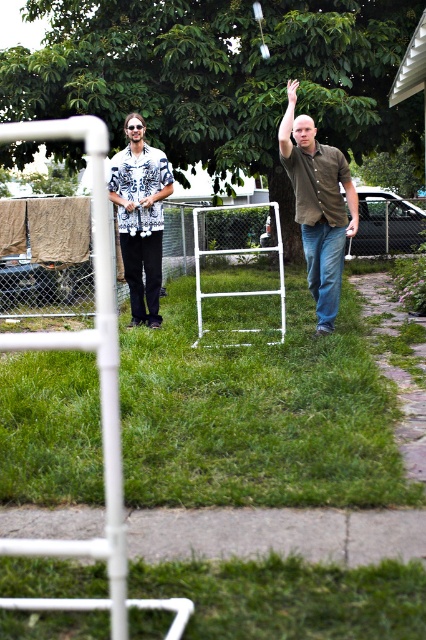
Question: Which object appears farthest from the camera in this image?

Choices:
 (A) green grass at center
 (B) green grass at lower center

Answer: (A)

Question: Considering the relative positions of brown matte shirt at center and white floral shirt at center in the image provided, where is brown matte shirt at center located with respect to white floral shirt at center?

Choices:
 (A) right
 (B) left

Answer: (A)

Question: Which of the following is the farthest from the observer?

Choices:
 (A) green grass at center
 (B) white metal fence at center

Answer: (B)

Question: Estimate the real-world distances between objects in this image. Which object is closer to the green grass at center?

Choices:
 (A) white metal fence at center
 (B) white floral shirt at center

Answer: (B)

Question: Does brown matte shirt at center have a larger size compared to white floral shirt at center?

Choices:
 (A) yes
 (B) no

Answer: (A)

Question: Does white metal fence at center have a greater width compared to white floral shirt at center?

Choices:
 (A) yes
 (B) no

Answer: (A)